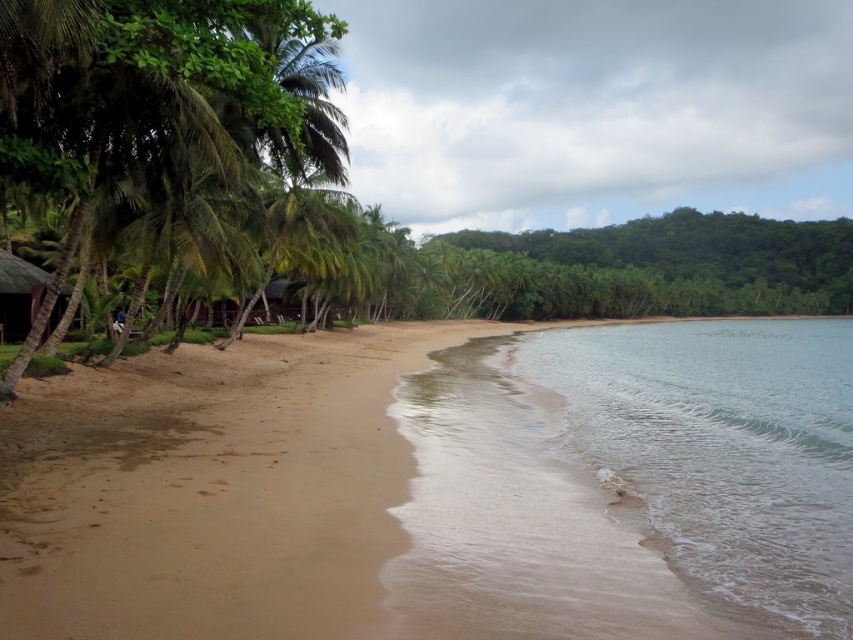
You are standing on the tropical beach and want to take a photo. There are two points marked on the sand. One is at coordinates point (225, 387) and the other is at point (689, 346). Which point will appear closer to you in the photo?

Point (225, 387) is closer to the camera than point (689, 346), so it will appear closer in the photo.

Looking at this image, you are a visitor standing on the brown sandy beach at center and want to take a photo of the dark brown wooden hut at left. Since the hut is taller than you, will you need to tilt your camera upwards to capture it in the photo?

The brown sandy beach at center is not as tall as the dark brown wooden hut at left, so yes, you will need to tilt your camera upwards to capture the dark brown wooden hut at left in the photo because it is taller than the beach area where you are standing.